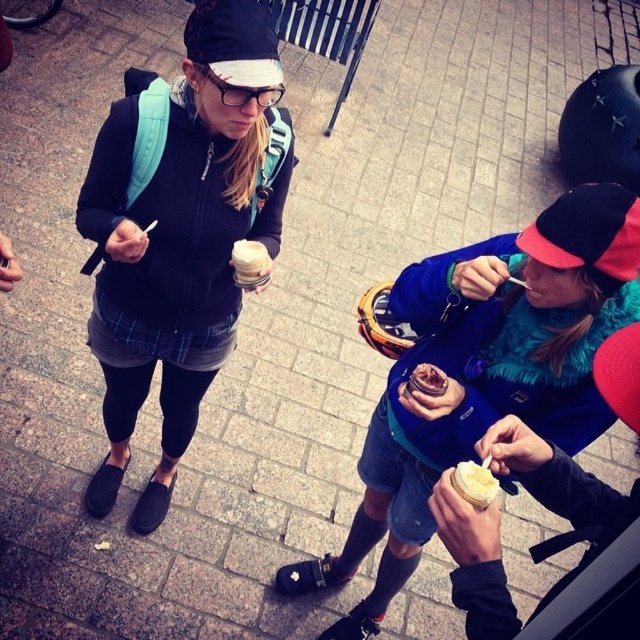
Does matte black jacket at center have a lesser width compared to white matte ice cream cone at center?

Incorrect, matte black jacket at center's width is not less than white matte ice cream cone at center's.

Is point (177, 323) farther from viewer compared to point (237, 248)?

Yes, point (177, 323) is behind point (237, 248).

This screenshot has width=640, height=640. In order to click on matte black jacket at center in this screenshot , I will do `click(179, 230)`.

Is fuzzy blue jacket at center taller than white creamy ice cream at lower right?

Yes, fuzzy blue jacket at center is taller than white creamy ice cream at lower right.

Measure the distance between point (605, 250) and camera.

The distance of point (605, 250) from camera is 4.92 feet.

Is point (451, 461) farther from viewer compared to point (492, 488)?

Yes, point (451, 461) is behind point (492, 488).

The height and width of the screenshot is (640, 640). I want to click on fuzzy blue jacket at center, so click(483, 374).

Is white creamy ice cream at lower right further to the viewer compared to white matte ice cream cone at center?

No, it is in front of white matte ice cream cone at center.

Is point (472, 483) behind point (246, 276)?

No, (472, 483) is in front of (246, 276).

Where is `white creamy ice cream at lower right`? Image resolution: width=640 pixels, height=640 pixels. white creamy ice cream at lower right is located at coordinates (474, 483).